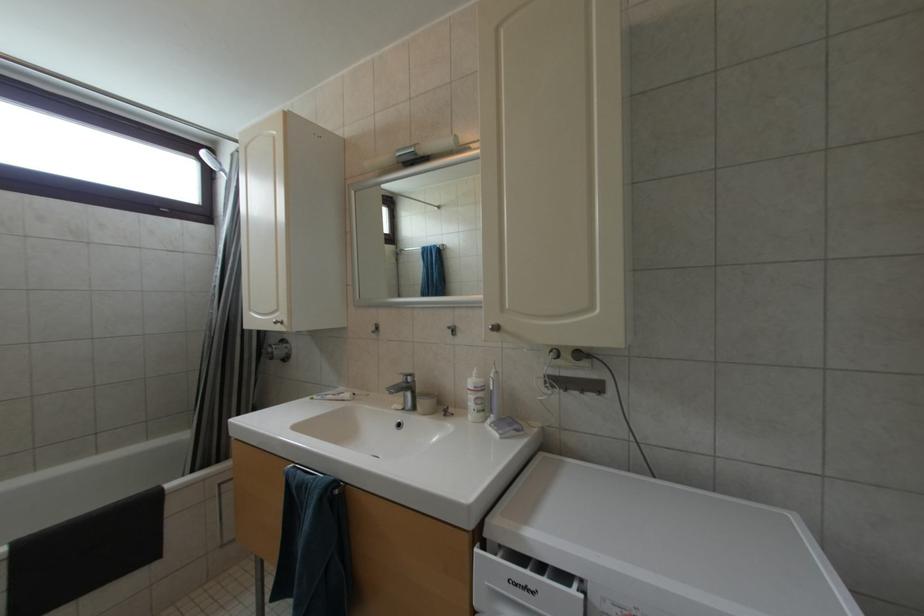
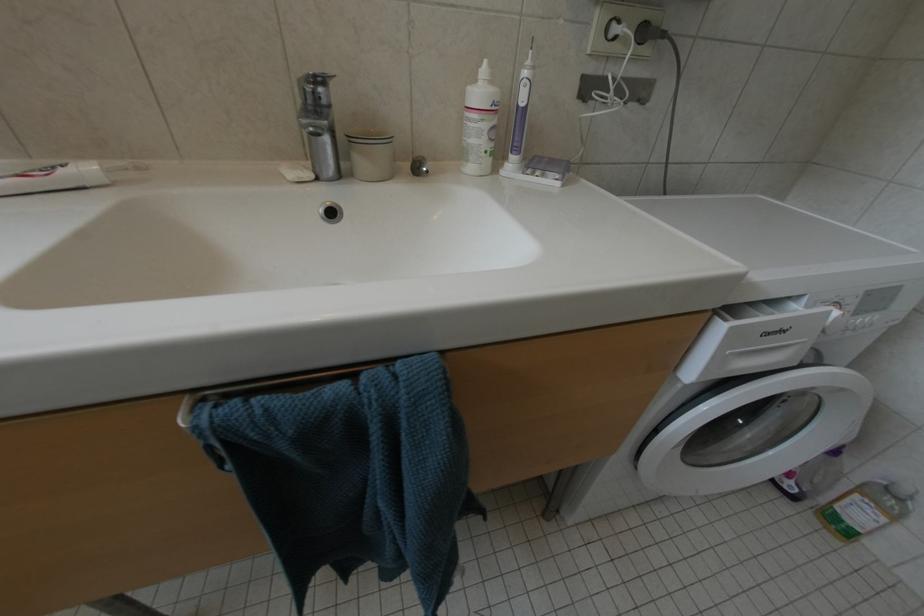
How did the camera likely rotate?

The rotation direction of the camera is right-down.